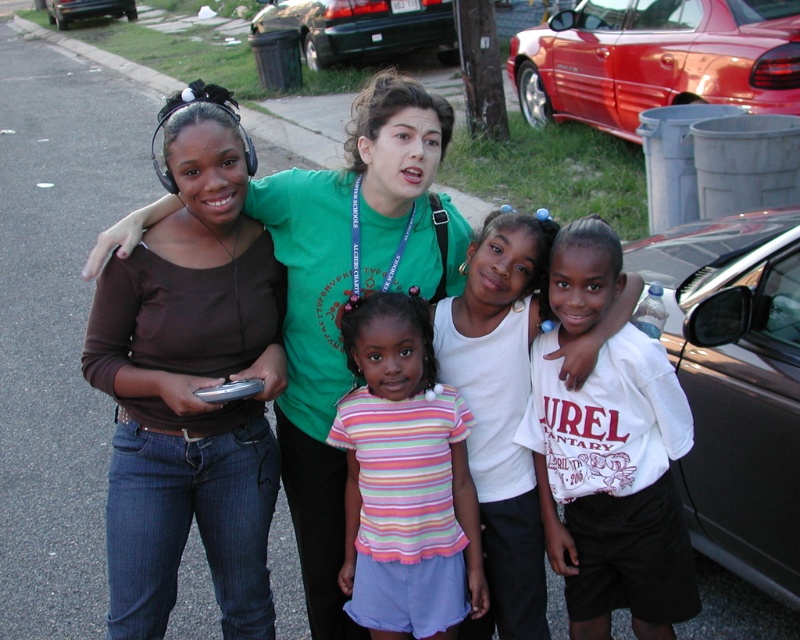
Which of these two, green matte car at upper center or shiny black car at upper left, stands taller?

green matte car at upper center is taller.

Between point (364, 52) and point (70, 20), which one is positioned behind?

Point (70, 20)

Is point (438, 3) closer to camera compared to point (69, 20)?

Yes, point (438, 3) is closer to viewer.

Where is `green matte car at upper center`? This screenshot has height=640, width=800. green matte car at upper center is located at coordinates (362, 28).

Is striped cotton shirt at center thinner than red metallic car at right?

Yes.

At what (x,y) coordinates should I click in order to perform the action: click on striped cotton shirt at center. Please return your answer as a coordinate pair (x, y). Looking at the image, I should click on (404, 480).

The width and height of the screenshot is (800, 640). Identify the location of striped cotton shirt at center. (404, 480).

Can you confirm if matte green t-shirt at center is taller than metallic gray car at right?

Yes, matte green t-shirt at center is taller than metallic gray car at right.

Can you confirm if matte green t-shirt at center is bigger than metallic gray car at right?

Incorrect, matte green t-shirt at center is not larger than metallic gray car at right.

Who is more forward, (390, 154) or (704, 548)?

Point (390, 154) is in front.

Locate an element on the screen. Image resolution: width=800 pixels, height=640 pixels. matte green t-shirt at center is located at coordinates (350, 292).